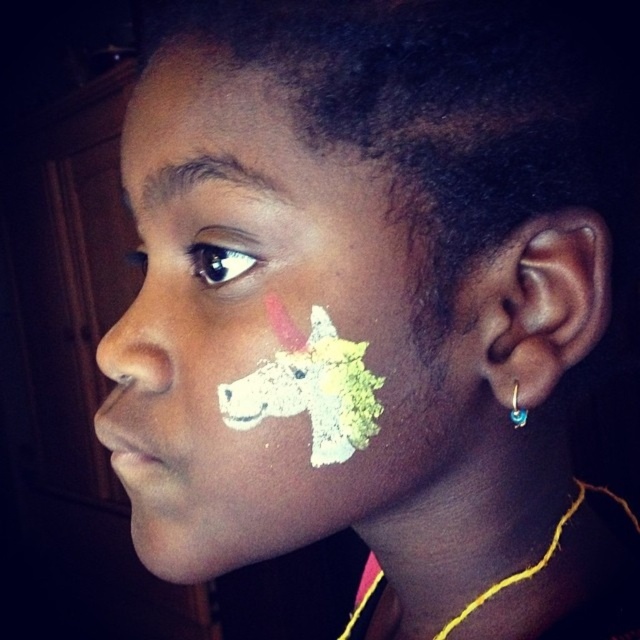
Image resolution: width=640 pixels, height=640 pixels. I want to click on matte skin at upper left, so click(205, 125).

Does matte skin at upper left have a lesser width compared to matte white nose at left?

In fact, matte skin at upper left might be wider than matte white nose at left.

The image size is (640, 640). Find the location of `matte skin at upper left`. matte skin at upper left is located at coordinates (205, 125).

Looking at this image, who is higher up, white matte unicorn at center or matte skin at upper left?

matte skin at upper left is higher up.

Find the location of a particular element. This screenshot has width=640, height=640. white matte unicorn at center is located at coordinates (276, 339).

Between matte skin at upper left and blue gemstone hoop at ear, which one has more height?

matte skin at upper left is taller.

Can you confirm if matte skin at upper left is positioned below blue gemstone hoop at ear?

No.

You are a GUI agent. You are given a task and a screenshot of the screen. Output one action in this format:
    pyautogui.click(x=<x>, y=<y>)
    Task: Click on the matte skin at upper left
    
    Given the screenshot: What is the action you would take?
    click(205, 125)

Locate an element on the screen. matte skin at upper left is located at coordinates (205, 125).